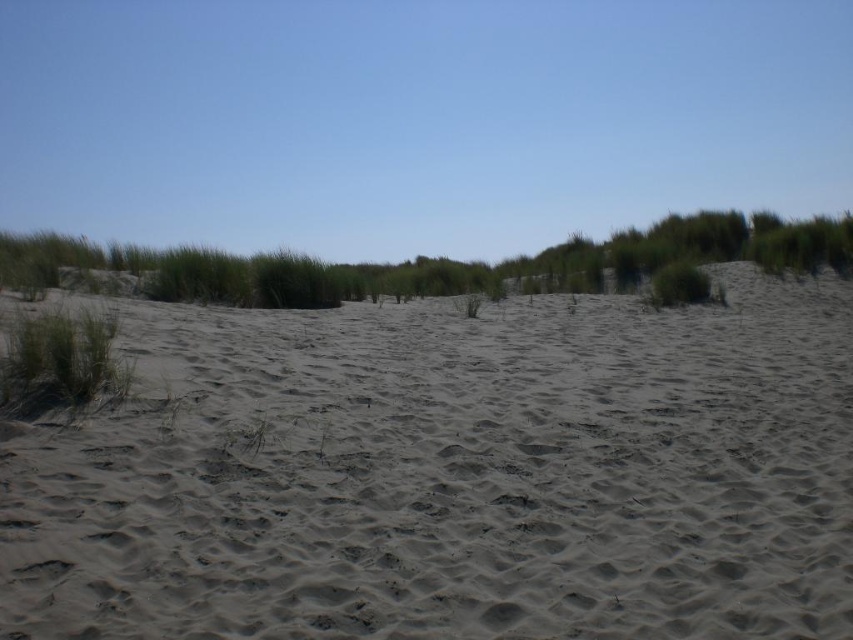
Question: Does smooth sand at center have a larger size compared to green grass at left?

Choices:
 (A) no
 (B) yes

Answer: (B)

Question: Does smooth sand at center lie in front of green grass at left?

Choices:
 (A) yes
 (B) no

Answer: (A)

Question: Does smooth sand at center appear on the right side of green grass at left?

Choices:
 (A) yes
 (B) no

Answer: (A)

Question: Among these objects, which one is farthest from the camera?

Choices:
 (A) smooth sand at center
 (B) green grass at left

Answer: (B)

Question: Among these points, which one is farthest from the camera?

Choices:
 (A) (59, 365)
 (B) (253, 588)

Answer: (A)